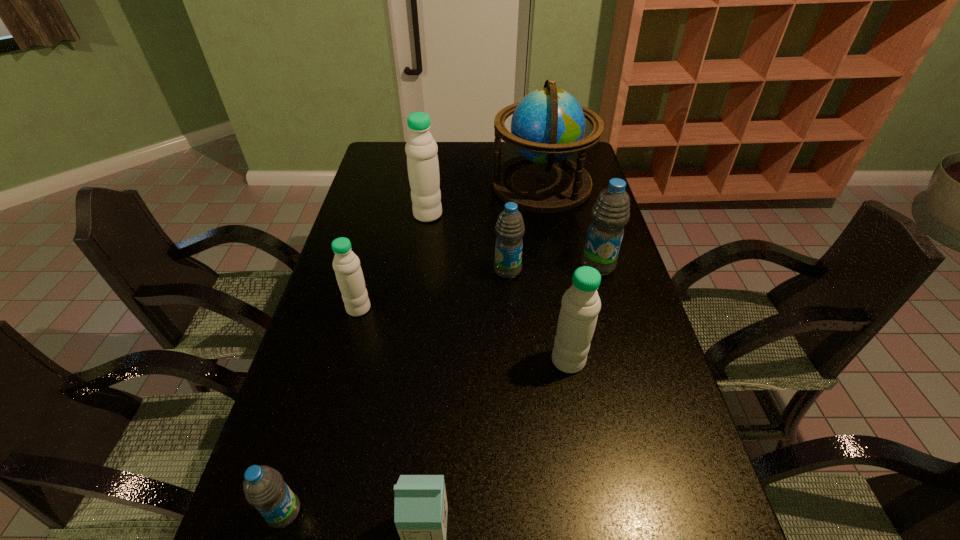
Find the location of a particular element. The width and height of the screenshot is (960, 540). globe is located at coordinates (548, 125).

Locate an element on the screen. The image size is (960, 540). the third white water bottle from right to left is located at coordinates (421, 149).

This screenshot has width=960, height=540. Find the location of `the biggest white water bottle`. the biggest white water bottle is located at coordinates (421, 149).

I want to click on the rightmost blue water bottle, so click(x=610, y=213).

Where is `the second nearest white water bottle`? This screenshot has width=960, height=540. the second nearest white water bottle is located at coordinates pos(581,304).

Where is `the fifth water bottle from left to right`? The width and height of the screenshot is (960, 540). the fifth water bottle from left to right is located at coordinates (581, 304).

Locate an element on the screen. the second smallest blue water bottle is located at coordinates (509, 229).

Locate an element on the screen. the second blue water bottle from left to right is located at coordinates (509, 229).

You are a GUI agent. You are given a task and a screenshot of the screen. Output one action in this format:
    pyautogui.click(x=<x>, y=<y>)
    Task: Click on the fifth farthest object
    
    Given the screenshot: What is the action you would take?
    pyautogui.click(x=346, y=264)

The image size is (960, 540). In order to click on the leftmost white water bottle in this screenshot , I will do `click(346, 264)`.